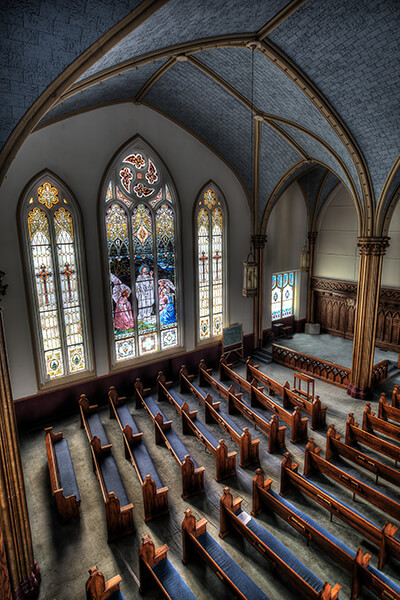
I want to click on window, so click(164, 276).